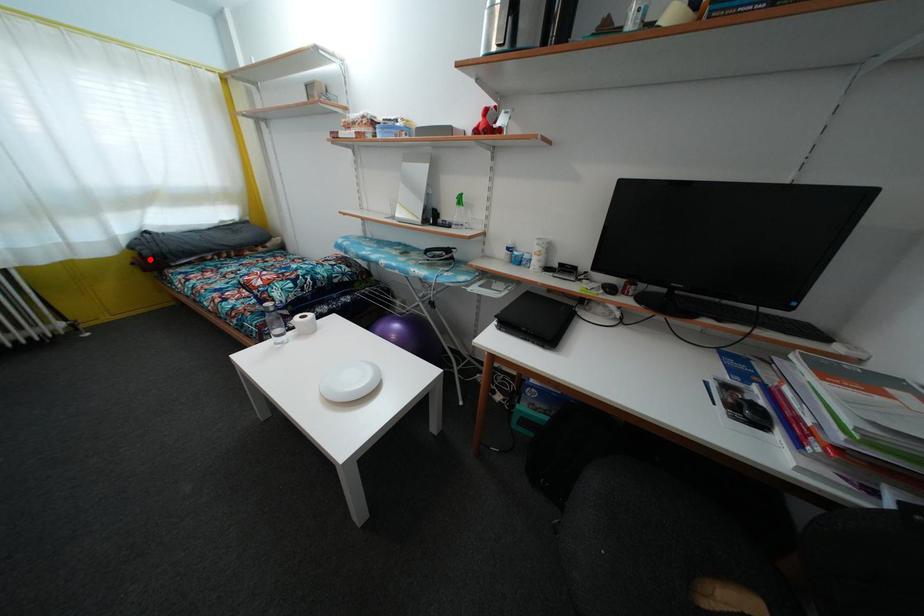
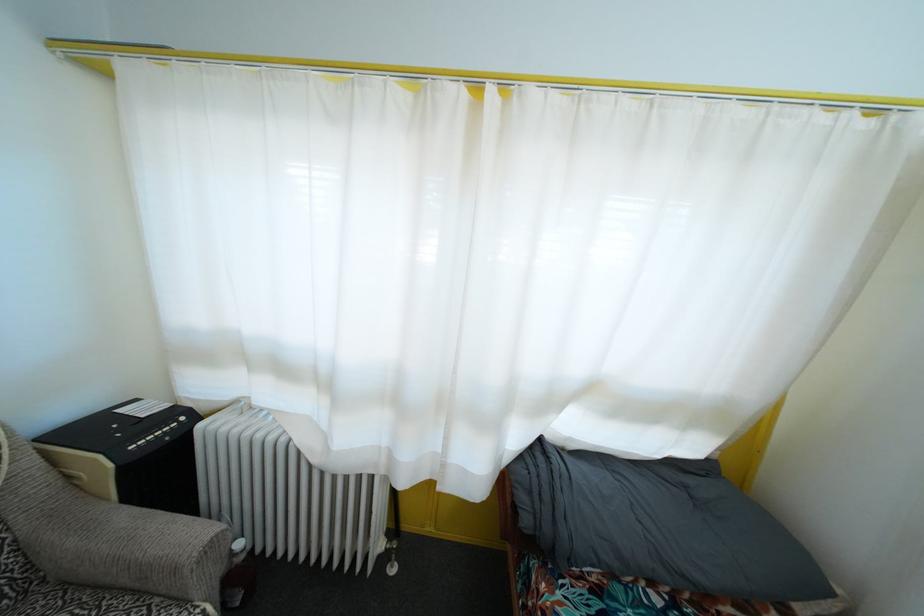
The point at the highlighted location is marked in the first image. Where is the corresponding point in the second image?

(529, 528)